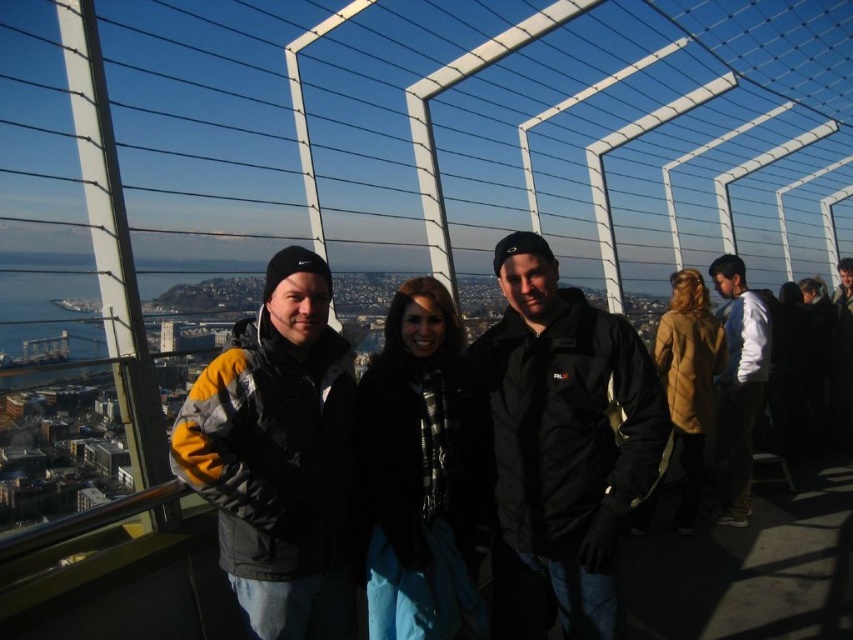
Question: Which object is closer to the camera taking this photo?

Choices:
 (A) white shirt at right
 (B) black matte jacket at center
 (C) yellow-gray jacket at center-left

Answer: (B)

Question: Can you confirm if black matte jacket at center is positioned to the left of white shirt at right?

Choices:
 (A) no
 (B) yes

Answer: (B)

Question: Among these objects, which one is farthest from the camera?

Choices:
 (A) white shirt at right
 (B) black matte jacket at center
 (C) yellow-gray jacket at center-left

Answer: (A)

Question: Which object is the farthest from the yellow-gray jacket at center-left?

Choices:
 (A) white shirt at right
 (B) black matte jacket at center

Answer: (A)

Question: Does black matte jacket at center appear on the right side of yellow-gray jacket at center-left?

Choices:
 (A) no
 (B) yes

Answer: (B)

Question: Is black matte jacket at center closer to the viewer compared to white shirt at right?

Choices:
 (A) yes
 (B) no

Answer: (A)